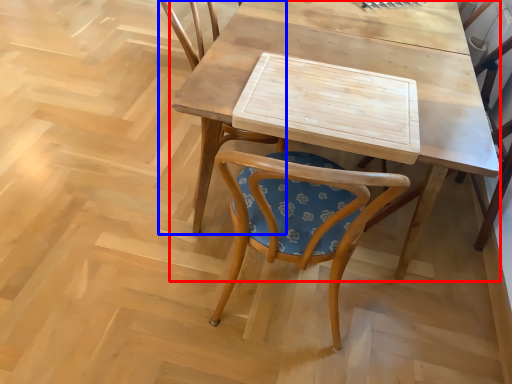
Question: Which object is further to the camera taking this photo, table (highlighted by a red box) or chair (highlighted by a blue box)?

Choices:
 (A) table
 (B) chair

Answer: (B)